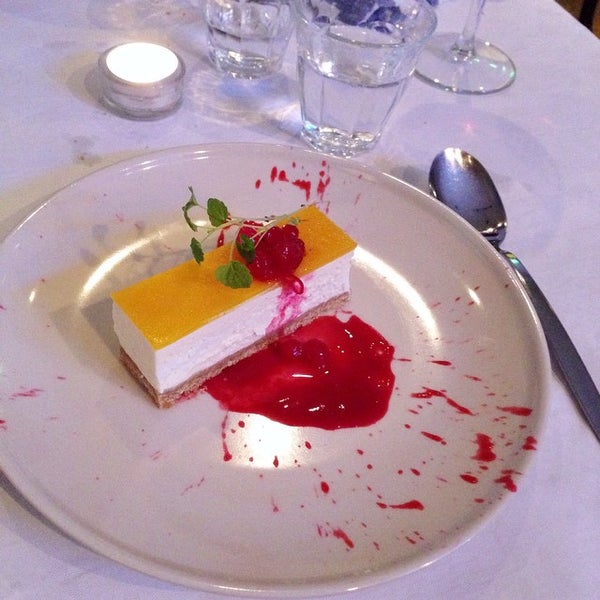
Find the location of `tablecloth`. tablecloth is located at coordinates (564, 172).